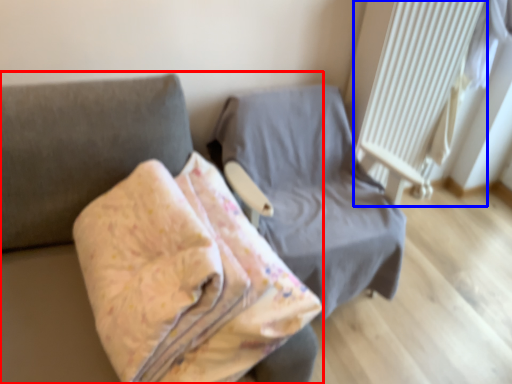
Question: Among these objects, which one is farthest to the camera, furniture (highlighted by a red box) or radiator (highlighted by a blue box)?

Choices:
 (A) furniture
 (B) radiator

Answer: (B)